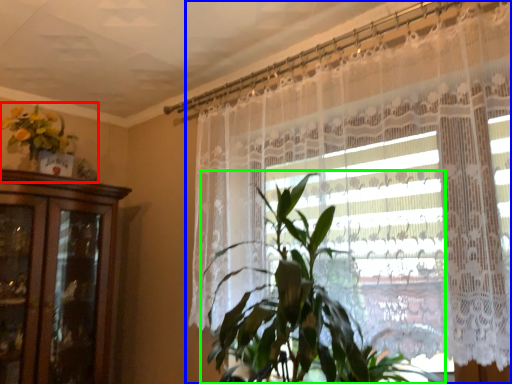
Question: Which object is the closest to the floral arrangement (highlighted by a red box)? Choose among these: curtain (highlighted by a blue box) or houseplant (highlighted by a green box).

Choices:
 (A) curtain
 (B) houseplant

Answer: (A)